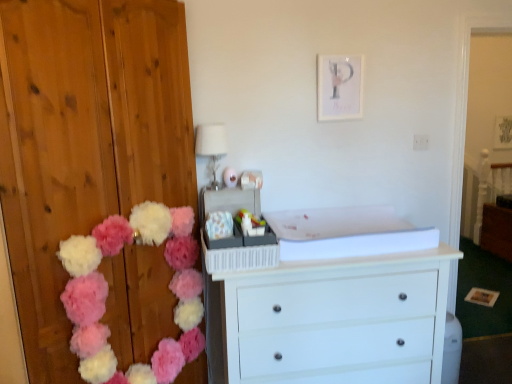
Question: Does point (210, 188) appear closer or farther from the camera than point (498, 221)?

Choices:
 (A) closer
 (B) farther

Answer: (A)

Question: Is white glass lampshade at upper center spatially inside brown wood cabinet at right, or outside of it?

Choices:
 (A) inside
 (B) outside

Answer: (B)

Question: Which of these objects is positioned farthest from the white glossy dresser at center?

Choices:
 (A) white glass lampshade at upper center
 (B) white painted wood chest of drawers at center
 (C) brown wood cabinet at right
 (D) fluffy fabric pom-poms at left

Answer: (C)

Question: Which object is the farthest from the white glass lampshade at upper center?

Choices:
 (A) fluffy fabric pom-poms at left
 (B) white glossy dresser at center
 (C) brown wood cabinet at right
 (D) white painted wood chest of drawers at center

Answer: (C)